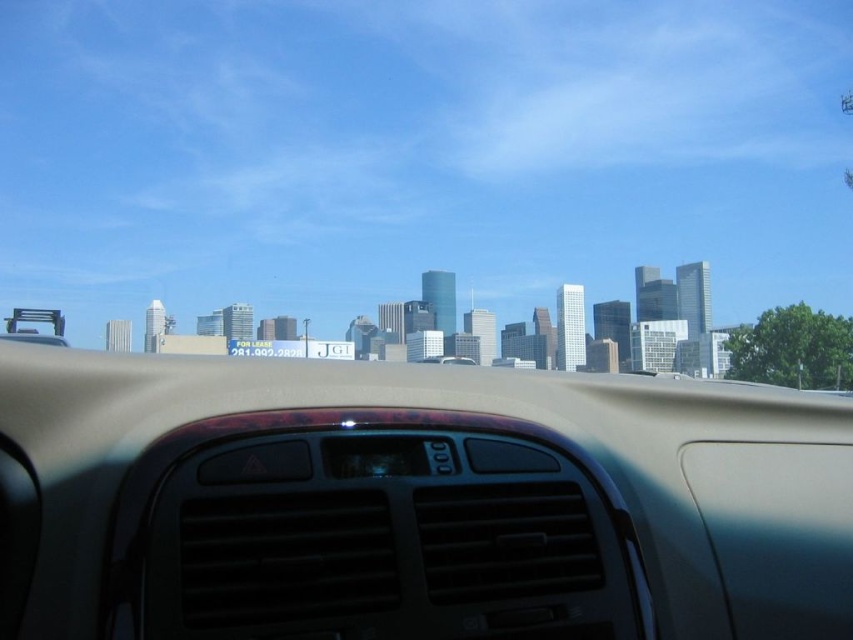
You are sitting in the driver seat of the car and want to adjust the temperature. The beige matte dashboard at center has a control panel, and the transparent plastic air vent at center is part of the ventilation system. Which object is closer to your hands when reaching forward?

The beige matte dashboard at center is closer to the viewer than the transparent plastic air vent at center, so when reaching forward, your hands would first encounter the beige matte dashboard at center before the transparent plastic air vent at center.

Based on the photo, you are sitting in the driver seat and want to adjust the temperature using the air vent. Which object is closer to your right hand when reaching from the steering wheel? The beige matte dashboard at center or the transparent plastic air vent at center?

The beige matte dashboard at center is to the right of the transparent plastic air vent at center, so it is closer to your right hand when reaching from the steering wheel.

You are driving a car and need to adjust the air vent. You see the beige matte dashboard at center and the transparent plastic air vent at center. Which object is bigger?

The beige matte dashboard at center is larger in size than the transparent plastic air vent at center.